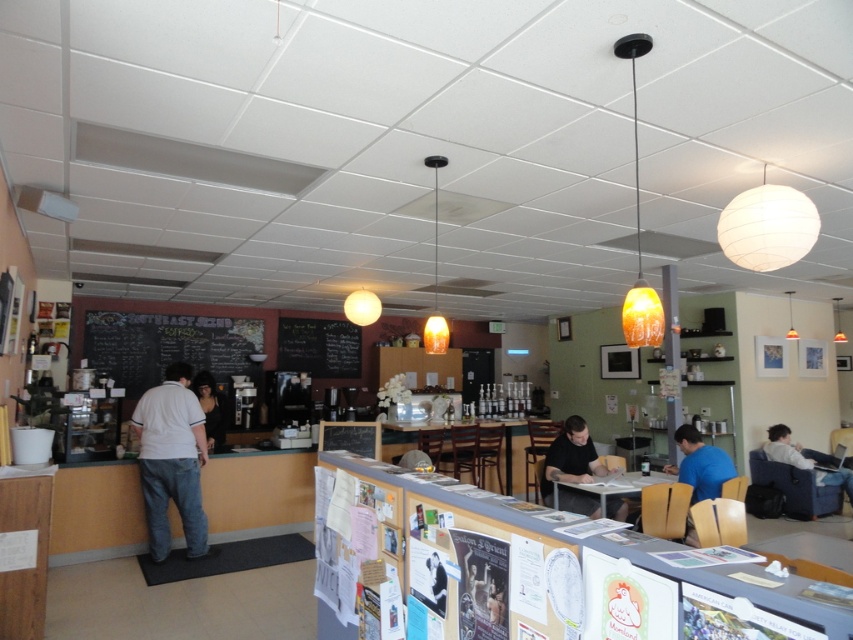
Who is more distant from viewer, (166, 387) or (793, 452)?

The point (793, 452) is behind.

From the picture: Who is taller, white cotton shirt at center or light blue fabric chair at lower right?

Standing taller between the two is white cotton shirt at center.

Is point (178, 396) positioned after point (843, 477)?

No, it is not.

Image resolution: width=853 pixels, height=640 pixels. I want to click on white cotton shirt at center, so click(171, 460).

Does white glossy table at center have a greater width compared to black fabric dress at center?

Yes, white glossy table at center is wider than black fabric dress at center.

Does white glossy table at center have a smaller size compared to black fabric dress at center?

Actually, white glossy table at center might be larger than black fabric dress at center.

Is point (608, 490) closer to camera compared to point (193, 388)?

That is True.

At what (x,y) coordinates should I click in order to perform the action: click on white glossy table at center. Please return your answer as a coordinate pair (x, y). This screenshot has height=640, width=853. Looking at the image, I should click on (612, 484).

In the scene shown: Between black matte shirt at center and wooden table at center, which one appears on the right side from the viewer's perspective?

From the viewer's perspective, black matte shirt at center appears more on the right side.

You are a GUI agent. You are given a task and a screenshot of the screen. Output one action in this format:
    pyautogui.click(x=<x>, y=<y>)
    Task: Click on the black matte shirt at center
    
    Given the screenshot: What is the action you would take?
    pyautogui.click(x=570, y=458)